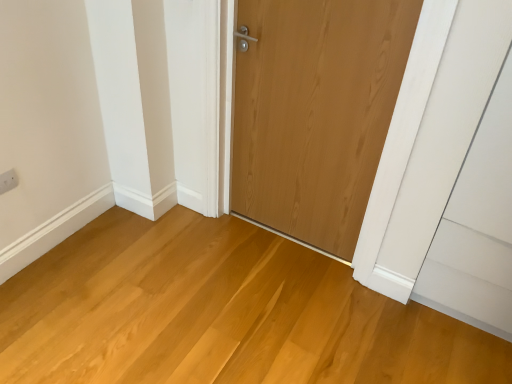
I want to click on vacant area that is in front of natural wood door at center, so click(x=283, y=302).